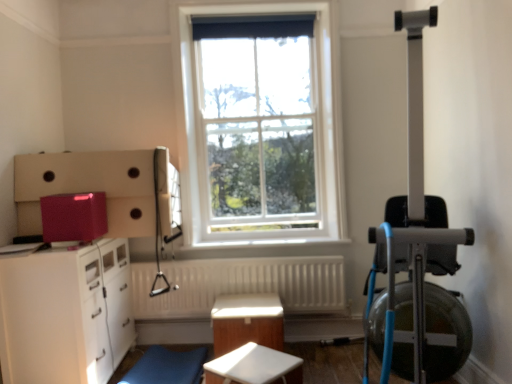
Question: Should I look upward or downward to see white glass window at center?

Choices:
 (A) up
 (B) down

Answer: (A)

Question: Does white glass window at center have a lesser height compared to white glossy table at center, which ranks as the 2th table in front-to-back order?

Choices:
 (A) yes
 (B) no

Answer: (B)

Question: Is white glass window at center outside white glossy table at center, which ranks as the 2th table in front-to-back order?

Choices:
 (A) yes
 (B) no

Answer: (A)

Question: Is white glass window at center closer to the viewer compared to white glossy table at center, which ranks as the 2th table in front-to-back order?

Choices:
 (A) yes
 (B) no

Answer: (B)

Question: Is white glass window at center directly adjacent to white glossy table at center, which ranks as the 2th table in front-to-back order?

Choices:
 (A) yes
 (B) no

Answer: (B)

Question: Would you say white glass window at center is a long distance from white glossy table at center, which ranks as the 2th table in front-to-back order?

Choices:
 (A) no
 (B) yes

Answer: (B)

Question: Is white glass window at center aimed at white glossy table at center, the 1th table viewed from the back?

Choices:
 (A) no
 (B) yes

Answer: (A)

Question: Does white textured radiator at center have a lesser height compared to white glossy cabinet at lower left?

Choices:
 (A) yes
 (B) no

Answer: (A)

Question: Is white textured radiator at center positioned before white glossy cabinet at lower left?

Choices:
 (A) no
 (B) yes

Answer: (A)

Question: Does white textured radiator at center have a greater height compared to white glossy cabinet at lower left?

Choices:
 (A) no
 (B) yes

Answer: (A)

Question: Is white textured radiator at center further to camera compared to white glossy cabinet at lower left?

Choices:
 (A) no
 (B) yes

Answer: (B)

Question: Does white textured radiator at center have a smaller size compared to white glossy cabinet at lower left?

Choices:
 (A) no
 (B) yes

Answer: (B)

Question: Can you confirm if white textured radiator at center is thinner than white glossy cabinet at lower left?

Choices:
 (A) no
 (B) yes

Answer: (B)

Question: Considering the relative sizes of white matte table at center, marked as the second table in a back-to-front arrangement, and blue fabric swivel chair at lower center in the image provided, is white matte table at center, marked as the second table in a back-to-front arrangement, shorter than blue fabric swivel chair at lower center?

Choices:
 (A) yes
 (B) no

Answer: (B)